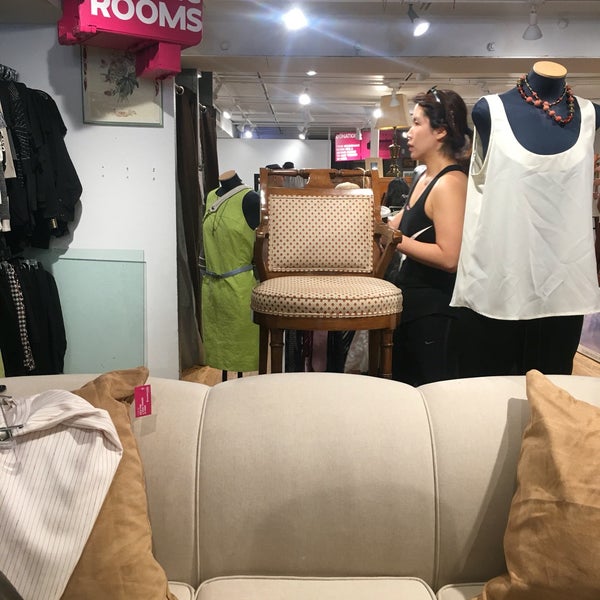
The width and height of the screenshot is (600, 600). Find the location of `curtain`. curtain is located at coordinates 188,148, 188,365.